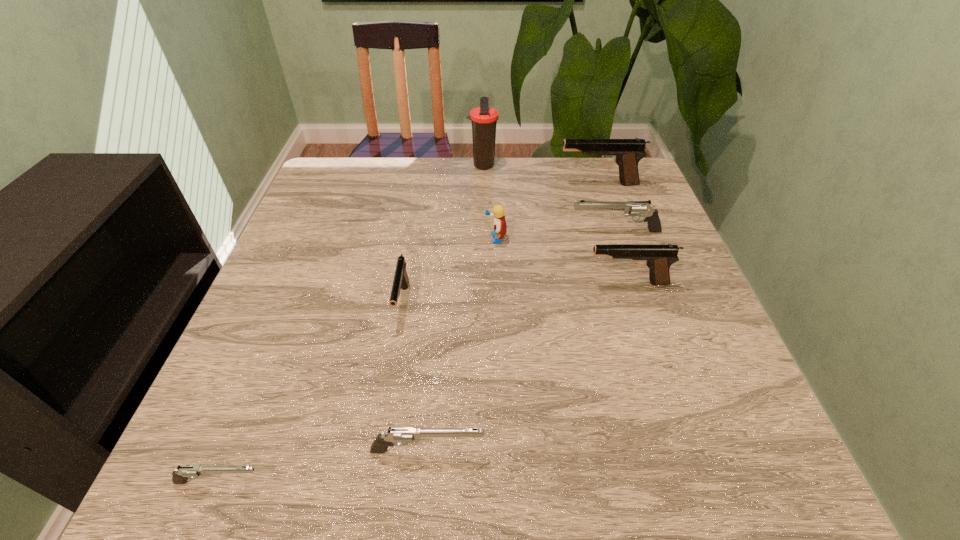
This screenshot has height=540, width=960. Find the location of `object that ranks as the fourth closest to the Lego`. object that ranks as the fourth closest to the Lego is located at coordinates (627, 153).

Point out which pistol is positioned as the third nearest to the smallest black pistol. Please provide its 2D coordinates. Your answer should be formatted as a tuple, i.e. [(x, y)], where the tuple contains the x and y coordinates of a point satisfying the conditions above.

[(658, 258)]

Find the location of a particular element. This screenshot has height=540, width=960. pistol that is the nearest to the second biggest silver pistol is located at coordinates (180, 475).

Select which black pistol appears as the second closest to the nearest silver pistol. Please provide its 2D coordinates. Your answer should be formatted as a tuple, i.e. [(x, y)], where the tuple contains the x and y coordinates of a point satisfying the conditions above.

[(658, 258)]

Locate an element on the screen. The width and height of the screenshot is (960, 540). black pistol that can be found as the second closest to the tallest object is located at coordinates (401, 280).

I want to click on silver pistol that is the closest to the biggest black pistol, so click(x=632, y=209).

Locate an element on the screen. The image size is (960, 540). the second closest silver pistol to the Lego is located at coordinates (399, 436).

This screenshot has width=960, height=540. I want to click on vacant area in the image that satisfies the following two spatial constraints: 1. at the muzzle of the smallest black pistol; 2. on the front-facing side of the leftmost silver pistol, so click(372, 482).

Where is `free spot that satisfies the following two spatial constraints: 1. on the front-facing side of the biggest silver pistol; 2. at the muzzle of the smallest black pistol`? The height and width of the screenshot is (540, 960). free spot that satisfies the following two spatial constraints: 1. on the front-facing side of the biggest silver pistol; 2. at the muzzle of the smallest black pistol is located at coordinates click(x=639, y=303).